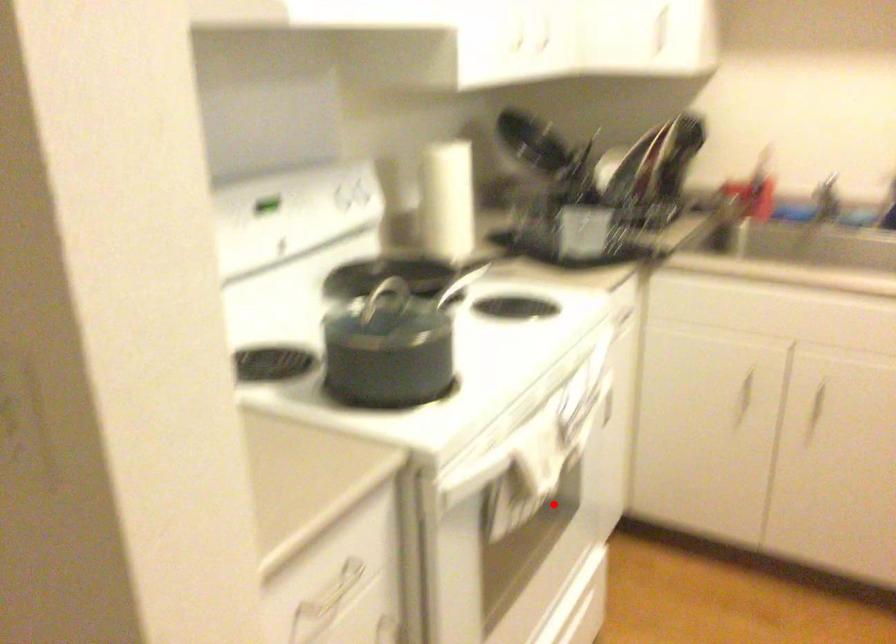
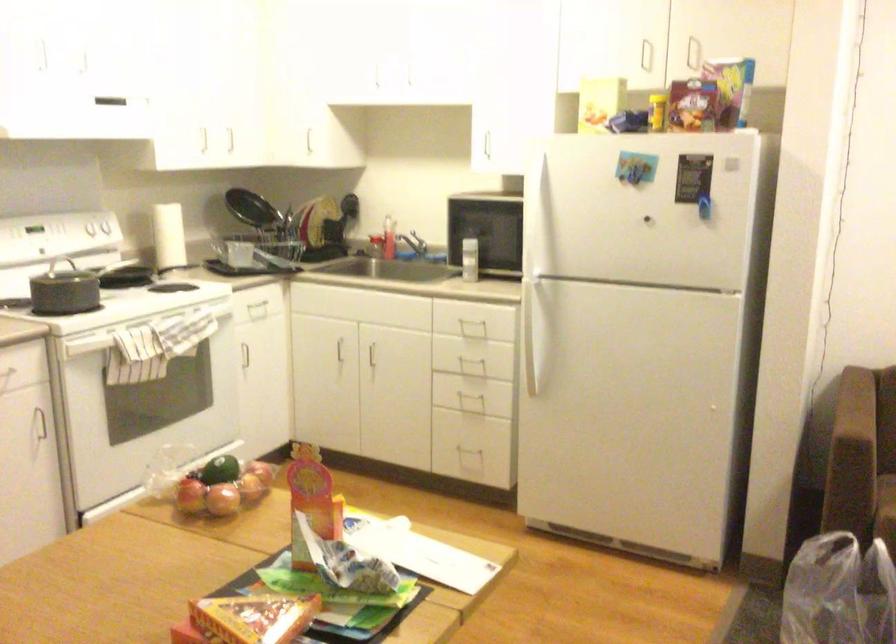
Question: I am providing you with two images of the same scene from different viewpoints. Image1 has a red point marked. In image2, the corresponding 3D location appears at what relative position? Reply with the corresponding letter.

Choices:
 (A) Closer
 (B) Farther

Answer: (B)